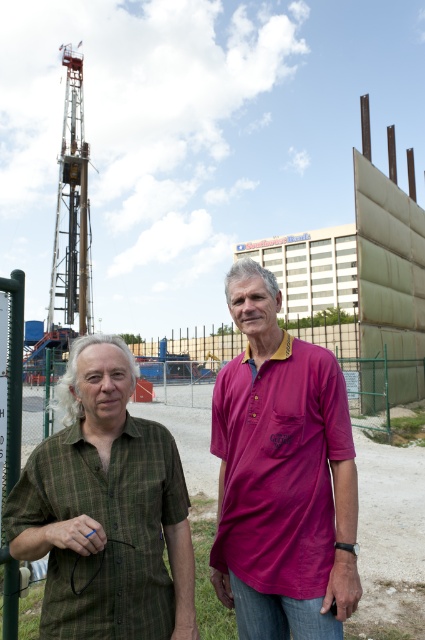
Does point (354, 561) come behind point (96, 356)?

Yes, point (354, 561) is behind point (96, 356).

Between pink cotton polo shirt at center and green plaid shirt at left, which one has more height?

With more height is pink cotton polo shirt at center.

I want to click on pink cotton polo shirt at center, so click(x=282, y=476).

At what (x,y) coordinates should I click in order to perform the action: click on pink cotton polo shirt at center. Please return your answer as a coordinate pair (x, y). Image resolution: width=425 pixels, height=640 pixels. Looking at the image, I should click on (282, 476).

Locate an element on the screen. green plaid shirt at center is located at coordinates (282, 476).

Does green plaid shirt at center appear on the right side of green plaid shirt at left?

Yes, green plaid shirt at center is to the right of green plaid shirt at left.

This screenshot has width=425, height=640. Describe the element at coordinates (282, 476) in the screenshot. I see `green plaid shirt at center` at that location.

Locate an element on the screen. green plaid shirt at center is located at coordinates (282, 476).

Can you confirm if green plaid shirt at center is bigger than pink cotton polo shirt at center?

Yes, green plaid shirt at center is bigger than pink cotton polo shirt at center.

The width and height of the screenshot is (425, 640). Describe the element at coordinates (282, 476) in the screenshot. I see `green plaid shirt at center` at that location.

Describe the element at coordinates (282, 476) in the screenshot. I see `green plaid shirt at center` at that location.

The height and width of the screenshot is (640, 425). What are the coordinates of `green plaid shirt at center` in the screenshot? It's located at (282, 476).